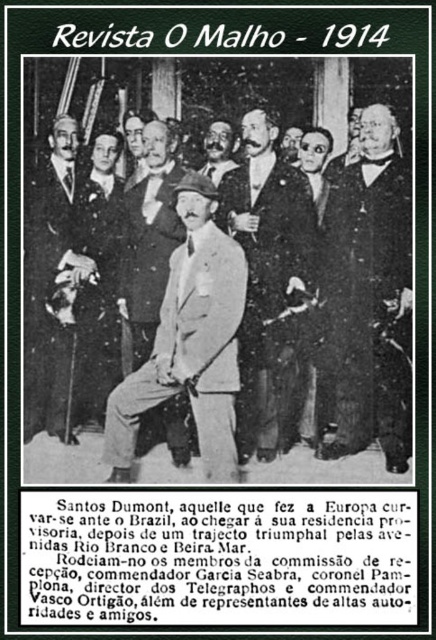
You are a tailor observing the men in the photograph. You need to determine which clothing item, the dark gray suit at right or the light brown leather coat at center, requires more fabric for alterations. Based on their sizes in the image, which one might need more fabric?

The dark gray suit at right is taller than the light brown leather coat at center, so it might require more fabric for alterations due to its larger size.